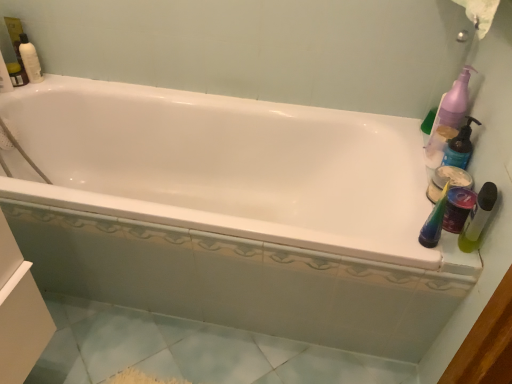
Identify the location of green matte bottle at right, marked as the 2th mouthwash in a back-to-front arrangement. (477, 218).

What do you see at coordinates (477, 218) in the screenshot? The height and width of the screenshot is (384, 512). I see `green matte bottle at right, placed as the 1th mouthwash when sorted from front to back` at bounding box center [477, 218].

What do you see at coordinates (460, 147) in the screenshot? The height and width of the screenshot is (384, 512). I see `matte white container at right, arranged as the 1th cleaning product when ordered from the bottom` at bounding box center [460, 147].

Find the location of `purple plastic pump bottle at upper right, arranged as the first cleaning product when viewed from the top`. purple plastic pump bottle at upper right, arranged as the first cleaning product when viewed from the top is located at coordinates (448, 118).

Considering the positions of point (440, 126) and point (128, 282), is point (440, 126) closer or farther from the camera than point (128, 282)?

Clearly, point (440, 126) is closer to the camera than point (128, 282).

The image size is (512, 384). In the image, there is a purple plastic pump bottle at upper right, which is counted as the 2th cleaning product, starting from the bottom. What are the coordinates of `bathtub below it (from a real-world perspective)` in the screenshot? It's located at (233, 213).

Is purple plastic pump bottle at upper right, which is counted as the 2th cleaning product, starting from the bottom, taller or shorter than white glossy bathtub at center?

Clearly, purple plastic pump bottle at upper right, which is counted as the 2th cleaning product, starting from the bottom, is shorter compared to white glossy bathtub at center.

From the picture: In the image, is purple plastic pump bottle at upper right, which is counted as the 2th cleaning product, starting from the bottom, positioned in front of or behind white glossy bathtub at center?

In the image, purple plastic pump bottle at upper right, which is counted as the 2th cleaning product, starting from the bottom, appears behind white glossy bathtub at center.

Would you consider green matte bottle at right, the 1th mouthwash positioned from the back, to be distant from green matte bottle at right, placed as the 1th mouthwash when sorted from front to back?

green matte bottle at right, the 1th mouthwash positioned from the back, is near green matte bottle at right, placed as the 1th mouthwash when sorted from front to back, not far away.

Is green matte bottle at right, the 1th mouthwash positioned from the back, bigger than green matte bottle at right, placed as the 1th mouthwash when sorted from front to back?

Indeed, green matte bottle at right, the 1th mouthwash positioned from the back, has a larger size compared to green matte bottle at right, placed as the 1th mouthwash when sorted from front to back.

This screenshot has width=512, height=384. Identify the location of mouthwash that appears behind the green matte bottle at right, placed as the 1th mouthwash when sorted from front to back. (447, 181).

Does matte white container at right, arranged as the 1th cleaning product when ordered from the bottom, turn towards purple plastic pump bottle at upper right, arranged as the first cleaning product when viewed from the top?

No, matte white container at right, arranged as the 1th cleaning product when ordered from the bottom, is not oriented towards purple plastic pump bottle at upper right, arranged as the first cleaning product when viewed from the top.

Considering the positions of points (445, 149) and (460, 98), is point (445, 149) farther from camera compared to point (460, 98)?

Yes.

From the picture: From a real-world perspective, is matte white container at right, arranged as the 1th cleaning product when ordered from the bottom, beneath purple plastic pump bottle at upper right, arranged as the first cleaning product when viewed from the top?

Yes, from a real-world perspective, matte white container at right, arranged as the 1th cleaning product when ordered from the bottom, is beneath purple plastic pump bottle at upper right, arranged as the first cleaning product when viewed from the top.

Does matte white container at right, arranged as the 1th cleaning product when ordered from the bottom, touch green matte bottle at right, placed as the 1th mouthwash when sorted from front to back?

There is a gap between matte white container at right, arranged as the 1th cleaning product when ordered from the bottom, and green matte bottle at right, placed as the 1th mouthwash when sorted from front to back.

Looking at this image, is matte white container at right, arranged as the 1th cleaning product when ordered from the bottom, bigger than green matte bottle at right, placed as the 1th mouthwash when sorted from front to back?

Yes, matte white container at right, arranged as the 1th cleaning product when ordered from the bottom, is bigger than green matte bottle at right, placed as the 1th mouthwash when sorted from front to back.

From the green matte bottle at right, placed as the 1th mouthwash when sorted from front to back, count 1st cleaning products backward and point to it. Please provide its 2D coordinates.

[(460, 147)]

Is green matte bottle at right, marked as the 2th mouthwash in a back-to-front arrangement, positioned with its back to purple plastic pump bottle at upper right, which is counted as the 2th cleaning product, starting from the bottom?

No, green matte bottle at right, marked as the 2th mouthwash in a back-to-front arrangement,'s orientation is not away from purple plastic pump bottle at upper right, which is counted as the 2th cleaning product, starting from the bottom.

Is green matte bottle at right, marked as the 2th mouthwash in a back-to-front arrangement, positioned before purple plastic pump bottle at upper right, arranged as the first cleaning product when viewed from the top?

Yes, the depth of green matte bottle at right, marked as the 2th mouthwash in a back-to-front arrangement, is less than that of purple plastic pump bottle at upper right, arranged as the first cleaning product when viewed from the top.

From the image's perspective, is green matte bottle at right, placed as the 1th mouthwash when sorted from front to back, above or below purple plastic pump bottle at upper right, arranged as the first cleaning product when viewed from the top?

From the image's perspective, green matte bottle at right, placed as the 1th mouthwash when sorted from front to back, appears below purple plastic pump bottle at upper right, arranged as the first cleaning product when viewed from the top.

From a real-world perspective, is green matte bottle at right, placed as the 1th mouthwash when sorted from front to back, on purple plastic pump bottle at upper right, arranged as the first cleaning product when viewed from the top?

No.

In the scene shown: Does purple plastic pump bottle at upper right, which is counted as the 2th cleaning product, starting from the bottom, appear on the left side of green matte bottle at right, placed as the 1th mouthwash when sorted from front to back?

No, purple plastic pump bottle at upper right, which is counted as the 2th cleaning product, starting from the bottom, is not to the left of green matte bottle at right, placed as the 1th mouthwash when sorted from front to back.

Which is farther from the camera, (443, 119) or (476, 206)?

Positioned behind is point (443, 119).

Would you say purple plastic pump bottle at upper right, which is counted as the 2th cleaning product, starting from the bottom, contains green matte bottle at right, placed as the 1th mouthwash when sorted from front to back?

Actually, green matte bottle at right, placed as the 1th mouthwash when sorted from front to back, is outside purple plastic pump bottle at upper right, which is counted as the 2th cleaning product, starting from the bottom.

Considering their positions, is purple plastic pump bottle at upper right, which is counted as the 2th cleaning product, starting from the bottom, located in front of or behind green matte bottle at right, marked as the 2th mouthwash in a back-to-front arrangement?

Visually, purple plastic pump bottle at upper right, which is counted as the 2th cleaning product, starting from the bottom, is located behind green matte bottle at right, marked as the 2th mouthwash in a back-to-front arrangement.

Is point (483, 209) closer or farther from the camera than point (471, 179)?

Point (483, 209) is closer to the camera than point (471, 179).

Are green matte bottle at right, marked as the 2th mouthwash in a back-to-front arrangement, and green matte bottle at right, the 1th mouthwash positioned from the back, located far from each other?

No, green matte bottle at right, marked as the 2th mouthwash in a back-to-front arrangement, is not far away from green matte bottle at right, the 1th mouthwash positioned from the back.

Considering the sizes of green matte bottle at right, marked as the 2th mouthwash in a back-to-front arrangement, and green matte bottle at right, the 2th mouthwash viewed from the front, in the image, is green matte bottle at right, marked as the 2th mouthwash in a back-to-front arrangement, wider or thinner than green matte bottle at right, the 2th mouthwash viewed from the front,?

In the image, green matte bottle at right, marked as the 2th mouthwash in a back-to-front arrangement, appears to be more narrow than green matte bottle at right, the 2th mouthwash viewed from the front.

Does green matte bottle at right, marked as the 2th mouthwash in a back-to-front arrangement, have a larger size compared to green matte bottle at right, the 2th mouthwash viewed from the front?

No.

Identify the location of bathtub located underneath the purple plastic pump bottle at upper right, which is counted as the 2th cleaning product, starting from the bottom (from a real-world perspective). (233, 213).

The width and height of the screenshot is (512, 384). What are the coordinates of `mouthwash on the left of green matte bottle at right, the 1th mouthwash positioned from the back` in the screenshot? It's located at (477, 218).

When comparing their distances from green matte bottle at right, placed as the 1th mouthwash when sorted from front to back, does purple plastic pump bottle at upper right, arranged as the first cleaning product when viewed from the top, or matte white container at right, arranged as the 1th cleaning product when ordered from the bottom, seem further?

purple plastic pump bottle at upper right, arranged as the first cleaning product when viewed from the top, is positioned further to the anchor green matte bottle at right, placed as the 1th mouthwash when sorted from front to back.

Estimate the real-world distances between objects in this image. Which object is closer to matte white container at right, arranged as the 1th cleaning product when ordered from the bottom, green matte bottle at right, the 1th mouthwash positioned from the back, or white glossy bathtub at center?

Based on the image, green matte bottle at right, the 1th mouthwash positioned from the back, appears to be nearer to matte white container at right, arranged as the 1th cleaning product when ordered from the bottom.

When comparing their distances from green matte bottle at right, the 1th mouthwash positioned from the back, does matte white container at right, arranged as the 1th cleaning product when ordered from the bottom, or white glossy bathtub at center seem closer?

matte white container at right, arranged as the 1th cleaning product when ordered from the bottom, lies closer to green matte bottle at right, the 1th mouthwash positioned from the back, than the other object.

Considering their positions, is green matte bottle at right, the 1th mouthwash positioned from the back, positioned further to white glossy bathtub at center than purple plastic pump bottle at upper right, which is counted as the 2th cleaning product, starting from the bottom?

green matte bottle at right, the 1th mouthwash positioned from the back, lies further to white glossy bathtub at center than the other object.

Based on their spatial positions, is green matte bottle at right, placed as the 1th mouthwash when sorted from front to back, or white glossy bathtub at center closer to green matte bottle at right, the 1th mouthwash positioned from the back?

green matte bottle at right, placed as the 1th mouthwash when sorted from front to back, is closer to green matte bottle at right, the 1th mouthwash positioned from the back.

From the image, which object appears to be farther from purple plastic pump bottle at upper right, which is counted as the 2th cleaning product, starting from the bottom, matte white container at right, arranged as the 1th cleaning product when ordered from the bottom, or green matte bottle at right, the 2th mouthwash viewed from the front?

The object further to purple plastic pump bottle at upper right, which is counted as the 2th cleaning product, starting from the bottom, is green matte bottle at right, the 2th mouthwash viewed from the front.

When comparing their distances from green matte bottle at right, the 2th mouthwash viewed from the front, does purple plastic pump bottle at upper right, which is counted as the 2th cleaning product, starting from the bottom, or matte white container at right, arranged as the 1th cleaning product when ordered from the bottom, seem closer?

Based on the image, matte white container at right, arranged as the 1th cleaning product when ordered from the bottom, appears to be nearer to green matte bottle at right, the 2th mouthwash viewed from the front.

When comparing their distances from white glossy bathtub at center, does matte white container at right, which is the second cleaning product from top to bottom, or green matte bottle at right, the 1th mouthwash positioned from the back, seem further?

matte white container at right, which is the second cleaning product from top to bottom, lies further to white glossy bathtub at center than the other object.

Find the location of a particular element. cleaning product between purple plastic pump bottle at upper right, arranged as the first cleaning product when viewed from the top, and green matte bottle at right, the 1th mouthwash positioned from the back, in the up-down direction is located at coordinates (460, 147).

Where is `cleaning product between green matte bottle at right, placed as the 1th mouthwash when sorted from front to back, and green matte bottle at right, the 2th mouthwash viewed from the front, along the z-axis`? Image resolution: width=512 pixels, height=384 pixels. cleaning product between green matte bottle at right, placed as the 1th mouthwash when sorted from front to back, and green matte bottle at right, the 2th mouthwash viewed from the front, along the z-axis is located at coordinates (460, 147).

Where is `cleaning product that lies between purple plastic pump bottle at upper right, arranged as the first cleaning product when viewed from the top, and green matte bottle at right, marked as the 2th mouthwash in a back-to-front arrangement, from top to bottom`? The height and width of the screenshot is (384, 512). cleaning product that lies between purple plastic pump bottle at upper right, arranged as the first cleaning product when viewed from the top, and green matte bottle at right, marked as the 2th mouthwash in a back-to-front arrangement, from top to bottom is located at coordinates (460, 147).

Where is `mouthwash between purple plastic pump bottle at upper right, which is counted as the 2th cleaning product, starting from the bottom, and green matte bottle at right, marked as the 2th mouthwash in a back-to-front arrangement, vertically`? mouthwash between purple plastic pump bottle at upper right, which is counted as the 2th cleaning product, starting from the bottom, and green matte bottle at right, marked as the 2th mouthwash in a back-to-front arrangement, vertically is located at coordinates [447, 181].